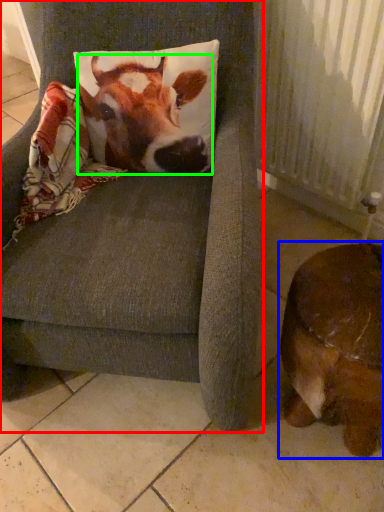
Question: Which is nearer to the chair (highlighted by a red box)? dog (highlighted by a blue box) or cattle (highlighted by a green box).

Choices:
 (A) dog
 (B) cattle

Answer: (B)